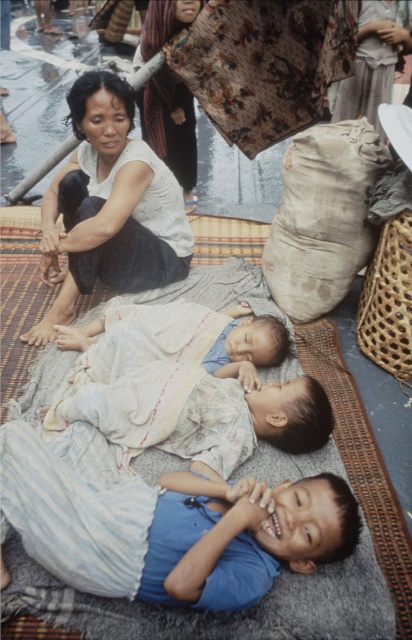
Is blue cotton shirt at lower center in front of matte brown scarf at upper center?

Yes.

Is blue cotton shirt at lower center shorter than matte brown scarf at upper center?

Indeed, blue cotton shirt at lower center has a lesser height compared to matte brown scarf at upper center.

Locate an element on the screen. blue cotton shirt at lower center is located at coordinates (166, 531).

The image size is (412, 640). Describe the element at coordinates (362, 461) in the screenshot. I see `gray woven mat at center` at that location.

Which is more to the right, gray woven mat at center or beige fabric sack at center?

beige fabric sack at center is more to the right.

Identify the location of gray woven mat at center. This screenshot has height=640, width=412. (362, 461).

Locate an element on the screen. white cotton shirt at upper left is located at coordinates (109, 208).

Between white cotton shirt at upper left and matte brown scarf at upper center, which one appears on the right side from the viewer's perspective?

Positioned to the right is matte brown scarf at upper center.

You are a GUI agent. You are given a task and a screenshot of the screen. Output one action in this format:
    pyautogui.click(x=<x>, y=<y>)
    Task: Click on the white cotton shirt at upper left
    This screenshot has width=412, height=640.
    Given the screenshot: What is the action you would take?
    pyautogui.click(x=109, y=208)

Find the location of a particular element. This screenshot has width=412, height=640. white cotton shirt at upper left is located at coordinates (109, 208).